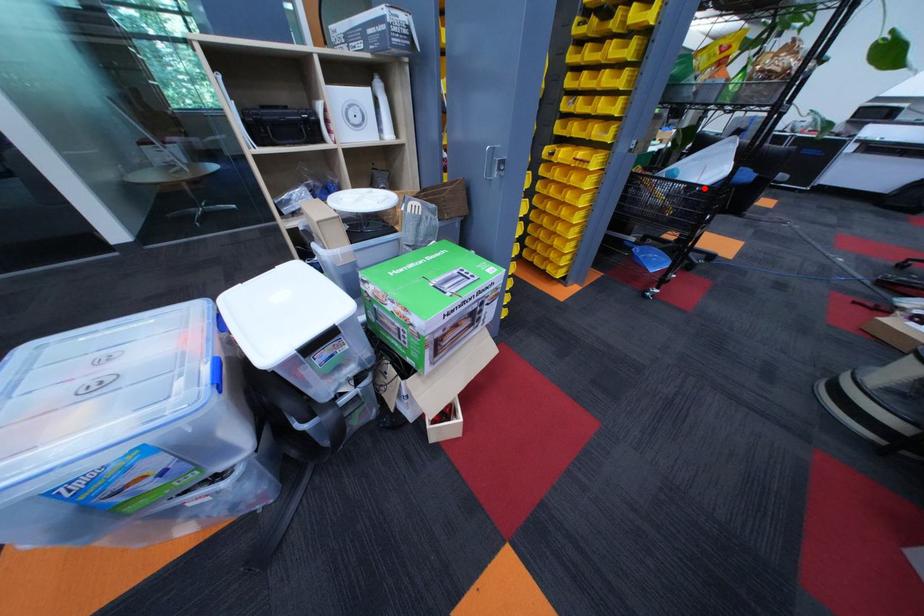
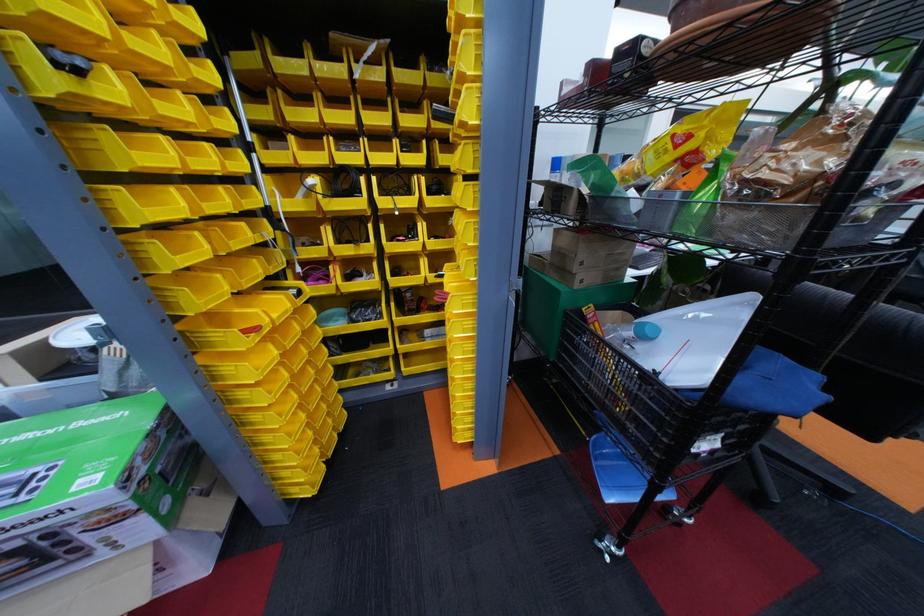
Locate, in the second image, the point that corresponds to the highlighted location in the first image.

(662, 378)